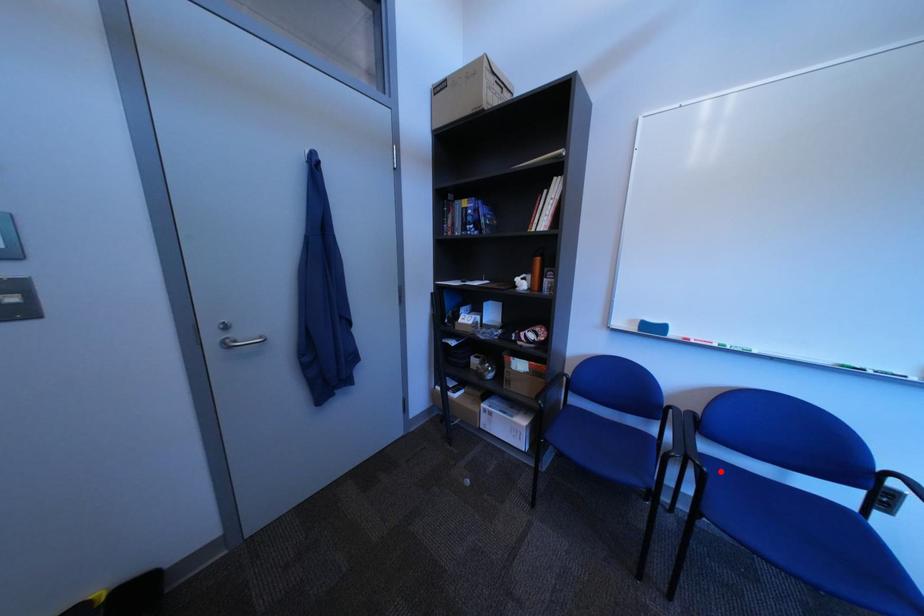
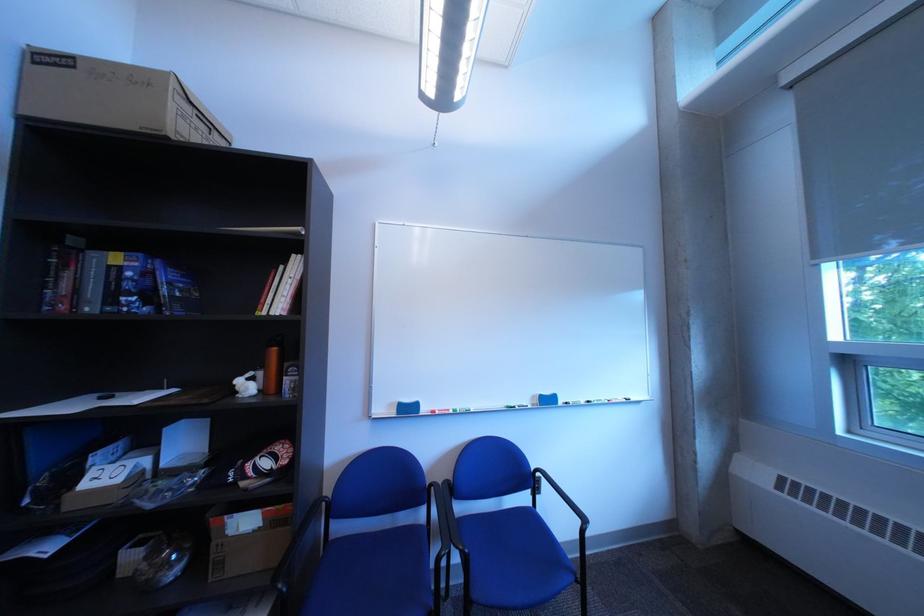
In the second image, find the point that corresponds to the highlighted location in the first image.

(482, 553)